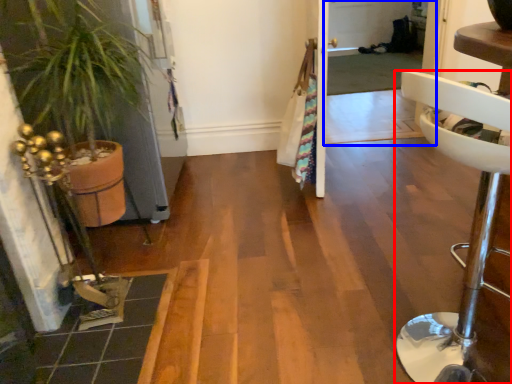
Question: Which object appears farthest to the camera in this image, furniture (highlighted by a red box) or screen door (highlighted by a blue box)?

Choices:
 (A) furniture
 (B) screen door

Answer: (B)